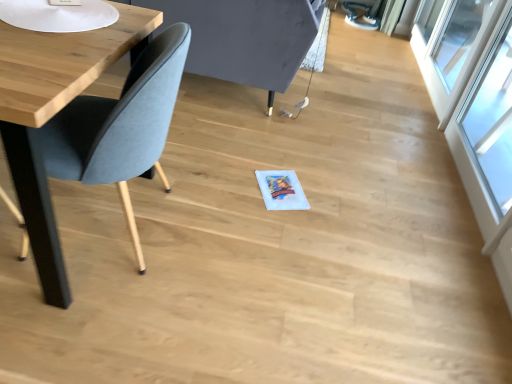
The width and height of the screenshot is (512, 384). Find the location of `vacant area located to the right-hand side of matte blue chair at left`. vacant area located to the right-hand side of matte blue chair at left is located at coordinates (217, 252).